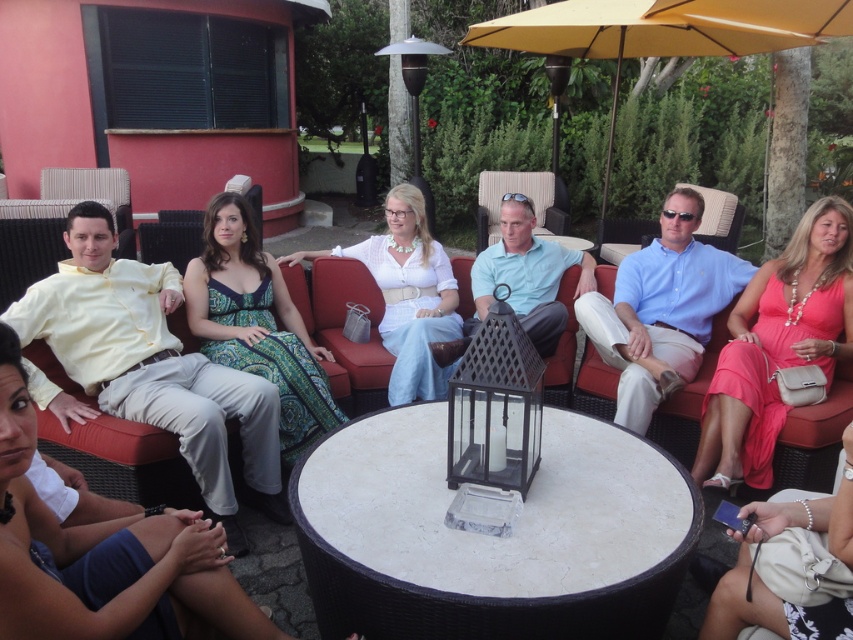
In the scene shown: You are planning to take a photo of the group and want to ensure both the yellow cotton shirt at left and the white cotton dress at center are in the frame. Based on their positions, which direction should you position the camera relative to the group to capture both effectively?

Since the yellow cotton shirt at left is to the left of the white cotton dress at center, positioning the camera to the right side of the group would allow both to be captured in the frame effectively.

You are planning to place a large centerpiece on the white marble table at center. Considering the space occupied by the yellow cotton shirt at left, will the table have enough room for the centerpiece?

The white marble table at center occupies less space than the yellow cotton shirt at left. Therefore, the table may not have sufficient space for a large centerpiece, as it is smaller in size compared to the area taken up by the yellow cotton shirt at left.

You are a photographer trying to capture a group photo of the yellow cotton shirt at left and the white cotton dress at center. The camera you are using has a minimum focus distance of 1 meter. Can you take a photo of both subjects without moving them?

The yellow cotton shirt at left and white cotton dress at center are 1.01 meters apart. Since the distance between them is slightly more than 1 meter, the camera can focus on both subjects as they are beyond the minimum focus distance requirement.